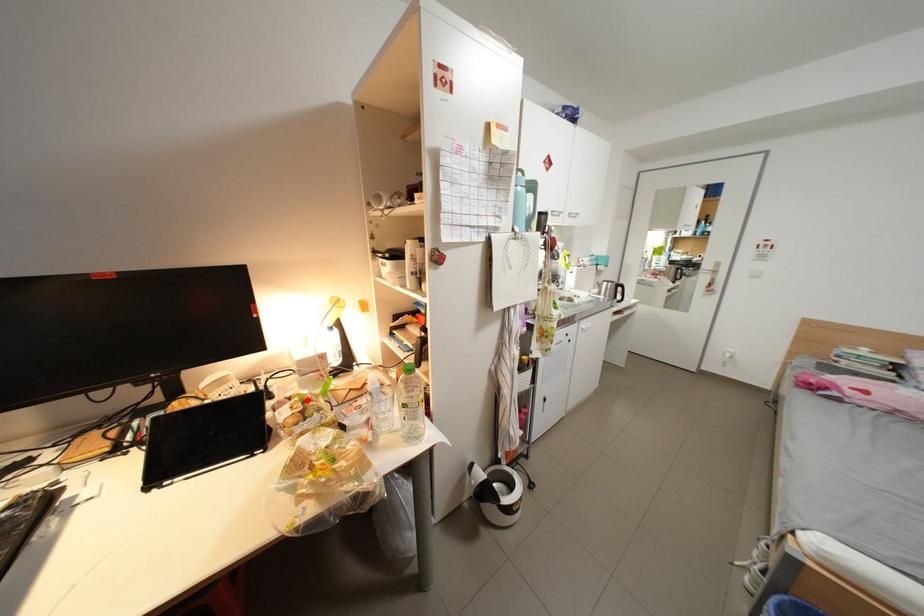
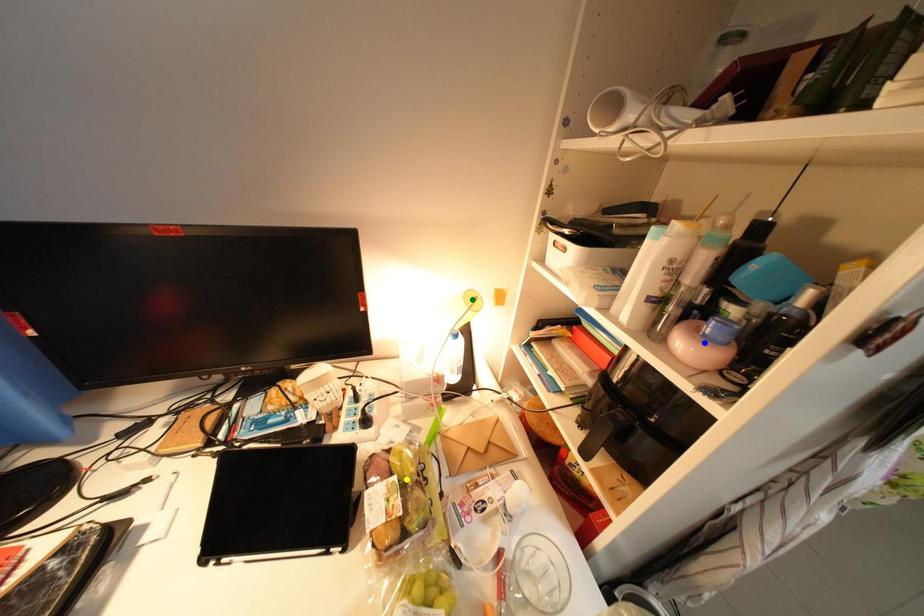
Question: I am providing you with two images of the same scene from different viewpoints. A red point is marked on the first image. You are given multiple points on the second image. In image 2, which mark is for the same physical point as the one in image 1?

Choices:
 (A) yellow point
 (B) blue point
 (C) green point

Answer: (A)